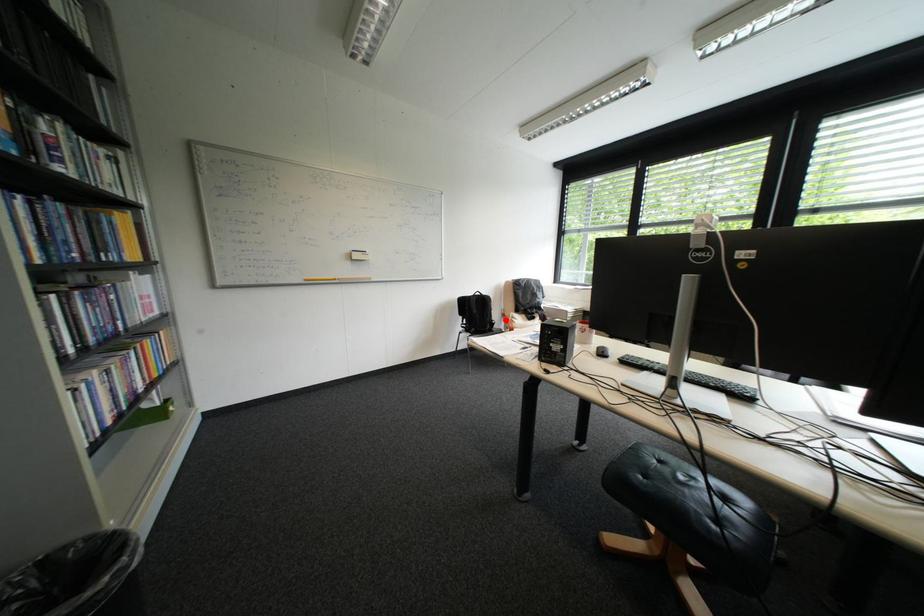
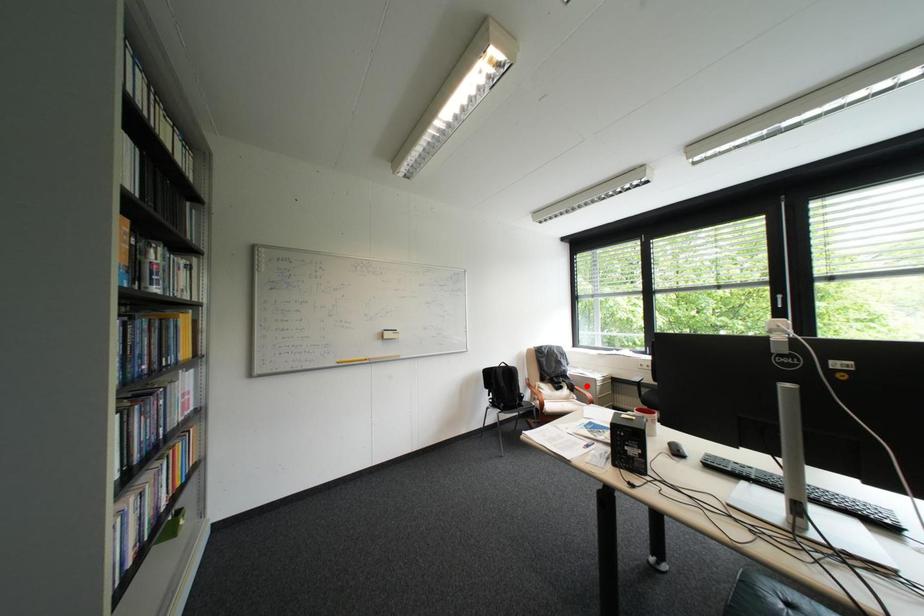
I am providing you with two images of the same scene from different viewpoints. A red point is marked on the first image and another point is marked on the second image. Are the points marked in image1 and image2 representing the same 3D position?

No